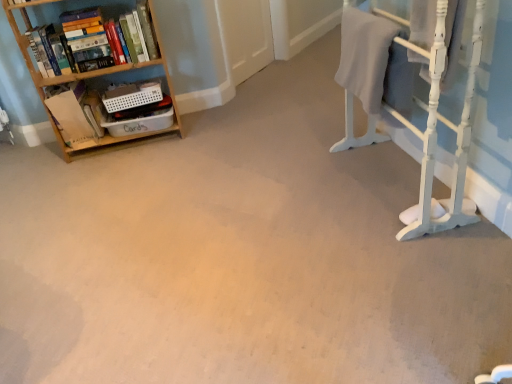
Question: Considering the relative positions of wooden bookshelf at left and hardcover books at left in the image provided, is wooden bookshelf at left to the left of hardcover books at left from the viewer's perspective?

Choices:
 (A) no
 (B) yes

Answer: (B)

Question: Can you confirm if wooden bookshelf at left is wider than hardcover books at left?

Choices:
 (A) no
 (B) yes

Answer: (B)

Question: Can you confirm if wooden bookshelf at left is thinner than hardcover books at left?

Choices:
 (A) no
 (B) yes

Answer: (A)

Question: Is wooden bookshelf at left with hardcover books at left?

Choices:
 (A) no
 (B) yes

Answer: (B)

Question: Are wooden bookshelf at left and hardcover books at left far apart?

Choices:
 (A) yes
 (B) no

Answer: (B)

Question: Does wooden bookshelf at left have a larger size compared to hardcover books at left?

Choices:
 (A) yes
 (B) no

Answer: (A)

Question: Is gray cotton bath towel at upper right positioned in front of hardcover books at left?

Choices:
 (A) yes
 (B) no

Answer: (A)

Question: From a real-world perspective, is gray cotton bath towel at upper right below hardcover books at left?

Choices:
 (A) yes
 (B) no

Answer: (A)

Question: Is gray cotton bath towel at upper right not close to hardcover books at left?

Choices:
 (A) no
 (B) yes

Answer: (B)

Question: Is gray cotton bath towel at upper right oriented towards hardcover books at left?

Choices:
 (A) no
 (B) yes

Answer: (A)

Question: Does gray cotton bath towel at upper right touch hardcover books at left?

Choices:
 (A) yes
 (B) no

Answer: (B)

Question: Can you confirm if gray cotton bath towel at upper right is shorter than hardcover books at left?

Choices:
 (A) no
 (B) yes

Answer: (A)

Question: Is gray cotton bath towel at upper right facing towards white painted wood bunk bed at right?

Choices:
 (A) yes
 (B) no

Answer: (A)